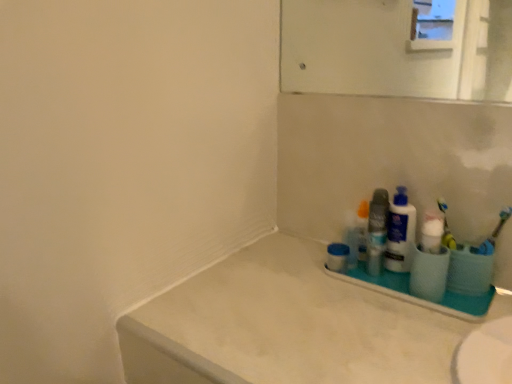
Question: Could you tell me if white matte counter top at lower right is turned towards blue matte jar at right?

Choices:
 (A) no
 (B) yes

Answer: (A)

Question: Does white matte counter top at lower right have a lesser width compared to blue matte jar at right?

Choices:
 (A) yes
 (B) no

Answer: (B)

Question: From a real-world perspective, is white matte counter top at lower right physically below blue matte jar at right?

Choices:
 (A) yes
 (B) no

Answer: (A)

Question: Is white matte counter top at lower right positioned in front of blue matte jar at right?

Choices:
 (A) no
 (B) yes

Answer: (B)

Question: From the image's perspective, is white matte counter top at lower right located above blue matte jar at right?

Choices:
 (A) yes
 (B) no

Answer: (B)

Question: Can you confirm if white matte counter top at lower right is taller than blue matte jar at right?

Choices:
 (A) no
 (B) yes

Answer: (B)

Question: Does white plastic bottle at right, which is the 2th cleaning product in front-to-back order, appear on the right side of blue rubber toothbrush at right, the first toothbrush positioned from the right?

Choices:
 (A) yes
 (B) no

Answer: (B)

Question: Is white plastic bottle at right, which is counted as the first cleaning product, starting from the back, smaller than blue rubber toothbrush at right, which is the second toothbrush from left to right?

Choices:
 (A) no
 (B) yes

Answer: (A)

Question: Is the depth of white plastic bottle at right, which is counted as the first cleaning product, starting from the back, less than that of blue rubber toothbrush at right, which is the second toothbrush from left to right?

Choices:
 (A) yes
 (B) no

Answer: (B)

Question: Is white plastic bottle at right, which is counted as the first cleaning product, starting from the back, oriented away from blue rubber toothbrush at right, which is the second toothbrush from left to right?

Choices:
 (A) yes
 (B) no

Answer: (B)

Question: Does white plastic bottle at right, which is counted as the first cleaning product, starting from the back, have a greater height compared to blue rubber toothbrush at right, which is the second toothbrush from left to right?

Choices:
 (A) yes
 (B) no

Answer: (A)

Question: Is white plastic bottle at right, which is the 2th cleaning product in front-to-back order, completely or partially outside of blue rubber toothbrush at right, the first toothbrush positioned from the right?

Choices:
 (A) no
 (B) yes

Answer: (B)

Question: Considering the relative sizes of white plastic bottle at right, which is counted as the first cleaning product, starting from the back, and yellow plastic toothbrush at right, which is counted as the first toothbrush, starting from the left, in the image provided, is white plastic bottle at right, which is counted as the first cleaning product, starting from the back, bigger than yellow plastic toothbrush at right, which is counted as the first toothbrush, starting from the left,?

Choices:
 (A) yes
 (B) no

Answer: (A)